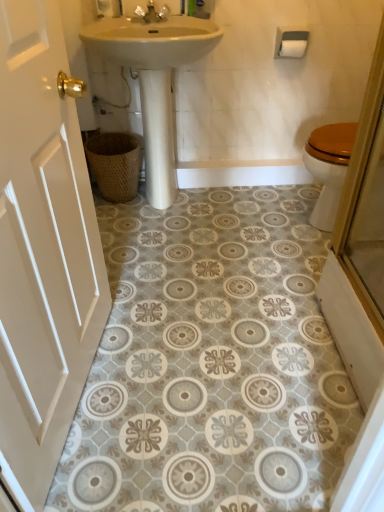
Question: From the image's perspective, is white painted wood door at left beneath woven brown basket at lower left?

Choices:
 (A) yes
 (B) no

Answer: (A)

Question: Considering the relative sizes of white painted wood door at left and woven brown basket at lower left in the image provided, is white painted wood door at left bigger than woven brown basket at lower left?

Choices:
 (A) yes
 (B) no

Answer: (A)

Question: Is white painted wood door at left with woven brown basket at lower left?

Choices:
 (A) yes
 (B) no

Answer: (B)

Question: Is white painted wood door at left far from woven brown basket at lower left?

Choices:
 (A) yes
 (B) no

Answer: (A)

Question: Considering the relative positions of white painted wood door at left and woven brown basket at lower left in the image provided, is white painted wood door at left in front of woven brown basket at lower left?

Choices:
 (A) yes
 (B) no

Answer: (A)

Question: Visually, is matte gold faucet at upper center positioned to the left or to the right of white matte toilet paper at upper right?

Choices:
 (A) right
 (B) left

Answer: (B)

Question: In terms of height, does matte gold faucet at upper center look taller or shorter compared to white matte toilet paper at upper right?

Choices:
 (A) short
 (B) tall

Answer: (B)

Question: In the image, is matte gold faucet at upper center positioned in front of or behind white matte toilet paper at upper right?

Choices:
 (A) front
 (B) behind

Answer: (A)

Question: Choose the correct answer: Is matte gold faucet at upper center inside white matte toilet paper at upper right or outside it?

Choices:
 (A) inside
 (B) outside

Answer: (B)

Question: Is white matte toilet paper at upper right in front of or behind woven brown basket at lower left in the image?

Choices:
 (A) behind
 (B) front

Answer: (B)

Question: Does point (291, 44) appear closer or farther from the camera than point (112, 183)?

Choices:
 (A) closer
 (B) farther

Answer: (A)

Question: From a real-world perspective, is white matte toilet paper at upper right physically located above or below woven brown basket at lower left?

Choices:
 (A) below
 (B) above

Answer: (B)

Question: Is white matte toilet paper at upper right inside the boundaries of woven brown basket at lower left, or outside?

Choices:
 (A) outside
 (B) inside

Answer: (A)

Question: From the image's perspective, is white matte toilet paper at upper right positioned above or below matte gold faucet at upper center?

Choices:
 (A) above
 (B) below

Answer: (B)

Question: Considering the positions of point (283, 40) and point (162, 18), is point (283, 40) closer or farther from the camera than point (162, 18)?

Choices:
 (A) farther
 (B) closer

Answer: (A)